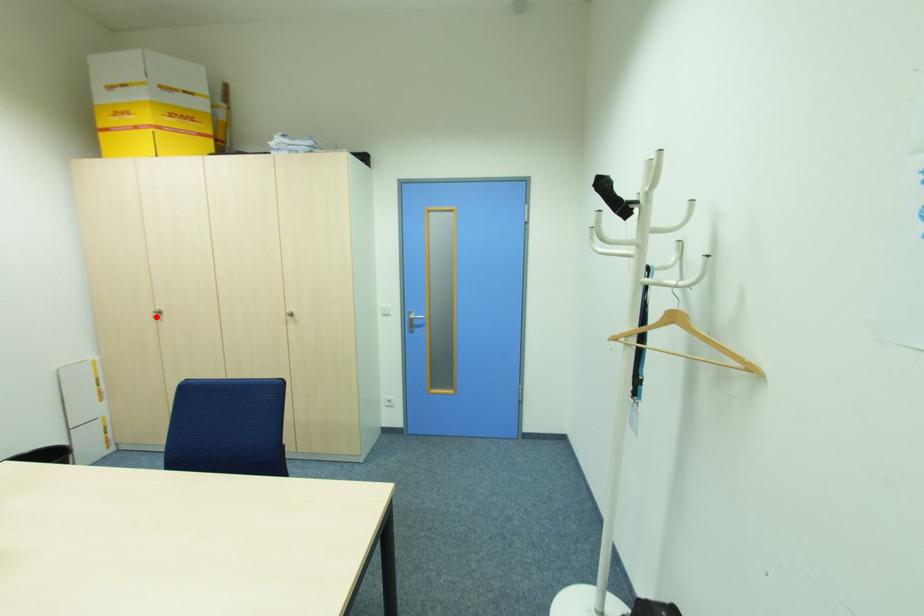
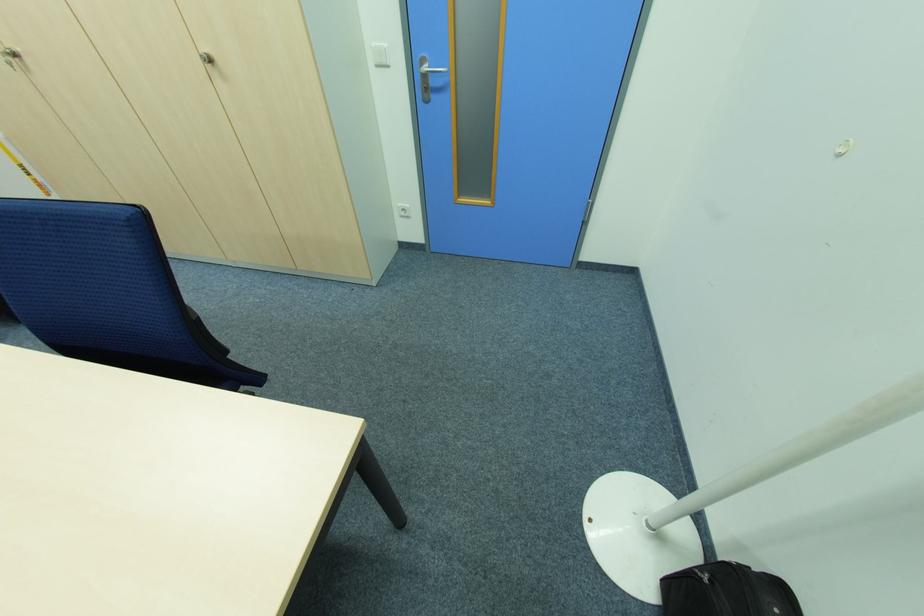
In the second image, find the point that corresponds to the highlighted location in the first image.

(14, 65)